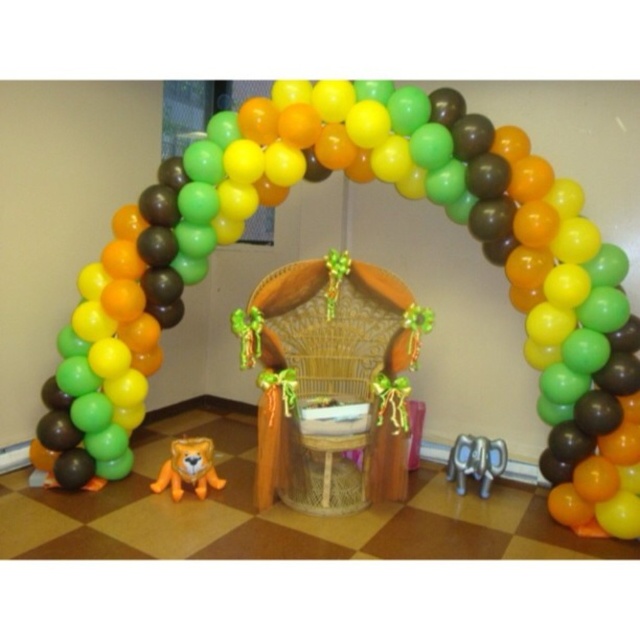
Question: Among these points, which one is nearest to the camera?

Choices:
 (A) (280, 392)
 (B) (544, 234)

Answer: (B)

Question: Is balloon arch at center thinner than woodenchair at center?

Choices:
 (A) yes
 (B) no

Answer: (B)

Question: Which object appears farthest from the camera in this image?

Choices:
 (A) woodenchair at center
 (B) balloon arch at center

Answer: (A)

Question: Does balloon arch at center appear under woodenchair at center?

Choices:
 (A) yes
 (B) no

Answer: (B)

Question: Where is balloon arch at center located in relation to woodenchair at center in the image?

Choices:
 (A) above
 (B) below

Answer: (A)